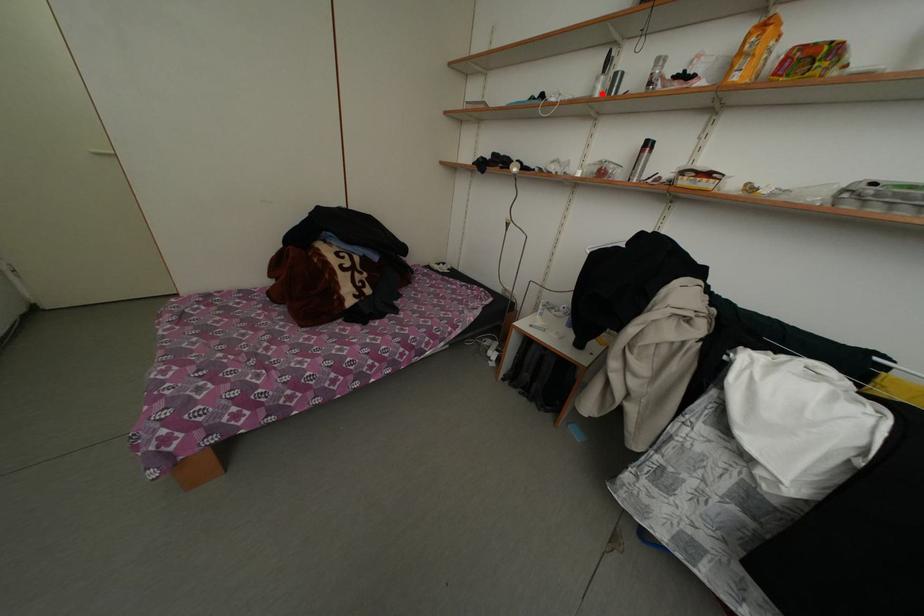
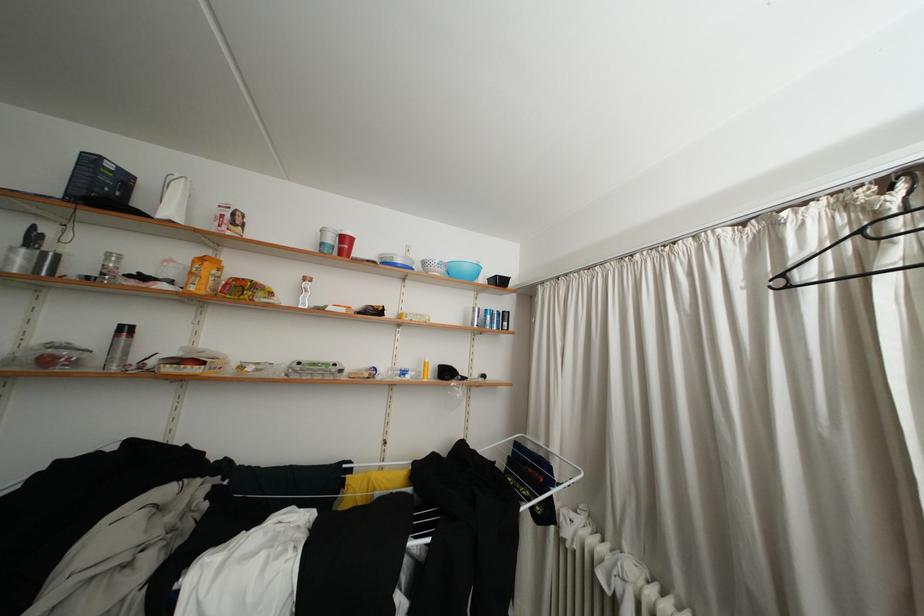
The point at the highlighted location is marked in the first image. Where is the corresponding point in the second image?

(17, 264)